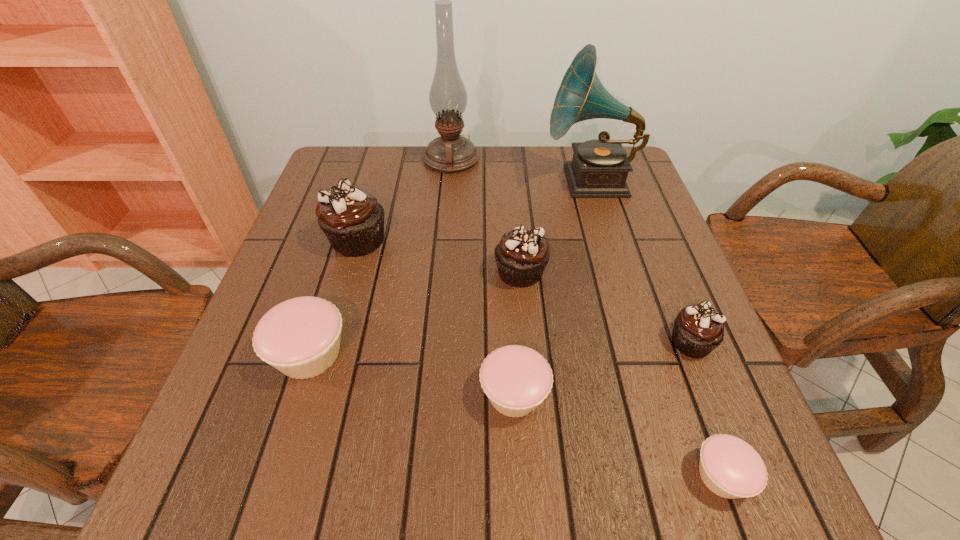
The height and width of the screenshot is (540, 960). I want to click on free area in between the nearest brown cupcake and the smallest pink cupcake, so click(x=707, y=409).

Locate an element on the screen. empty location between the fifth shortest object and the second biggest pink cupcake is located at coordinates (517, 333).

Identify the location of free space between the tallest cupcake and the leftmost pink cupcake. Image resolution: width=960 pixels, height=540 pixels. (334, 297).

Where is `vacant region between the second smallest pink cupcake and the fourth tallest object`? This screenshot has height=540, width=960. vacant region between the second smallest pink cupcake and the fourth tallest object is located at coordinates (517, 333).

At what (x,y) coordinates should I click in order to perform the action: click on vacant space that is in between the second smallest pink cupcake and the biggest pink cupcake. Please return your answer as a coordinate pair (x, y). The image size is (960, 540). Looking at the image, I should click on (412, 374).

This screenshot has height=540, width=960. What are the coordinates of `vacant region between the sixth shortest object and the smallest brown cupcake` in the screenshot? It's located at (524, 291).

I want to click on free space between the phonograph_record and the rightmost pink cupcake, so click(656, 328).

Where is `the sixth closest object to the third tallest object`? This screenshot has height=540, width=960. the sixth closest object to the third tallest object is located at coordinates (698, 329).

This screenshot has width=960, height=540. I want to click on the second closest object to the leftmost pink cupcake, so click(516, 379).

Point out which cupcake is positioned as the fourth nearest to the second smallest brown cupcake. Please provide its 2D coordinates. Your answer should be formatted as a tuple, i.e. [(x, y)], where the tuple contains the x and y coordinates of a point satisfying the conditions above.

[(300, 337)]